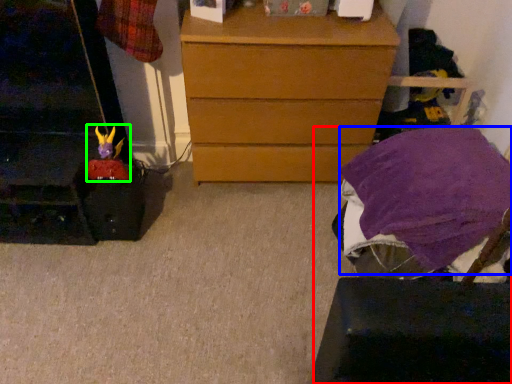
Question: Estimate the real-world distances between objects in this image. Which object is farther from furniture (highlighted by a red box), blanket (highlighted by a blue box) or toy (highlighted by a green box)?

Choices:
 (A) blanket
 (B) toy

Answer: (B)